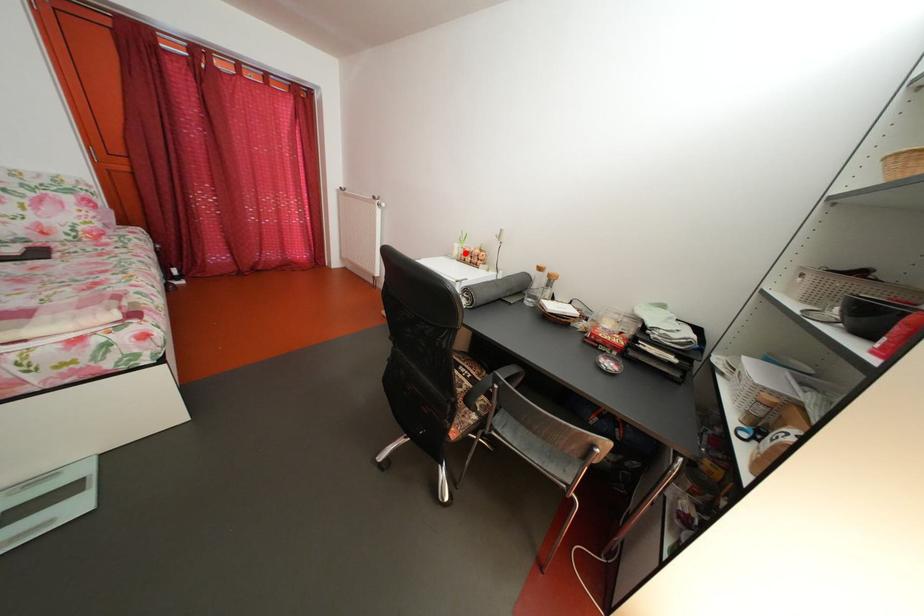
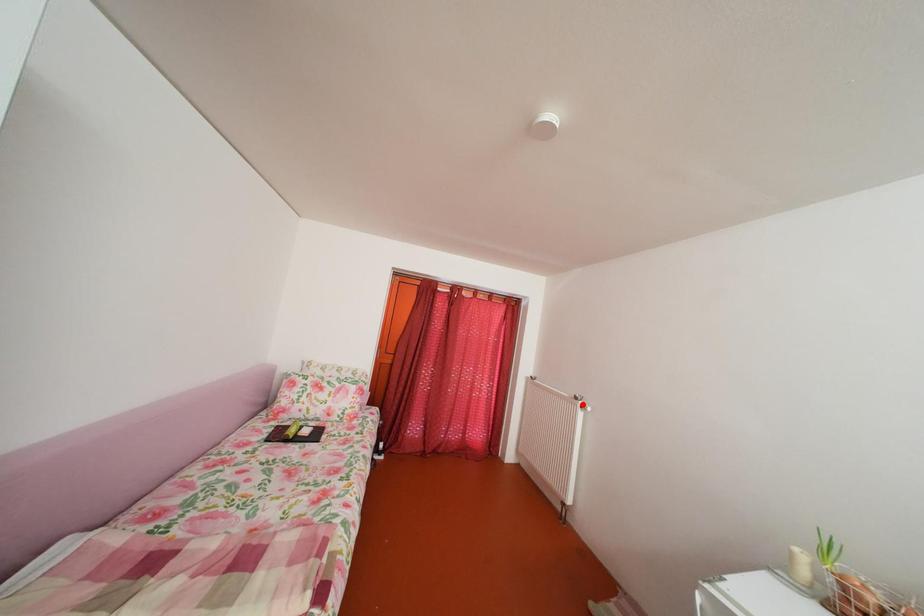
I am providing you with two images of the same scene from different viewpoints. A red point is marked on the first image and another point is marked on the second image. Is the marked point in image1 the same physical position as the marked point in image2?

No